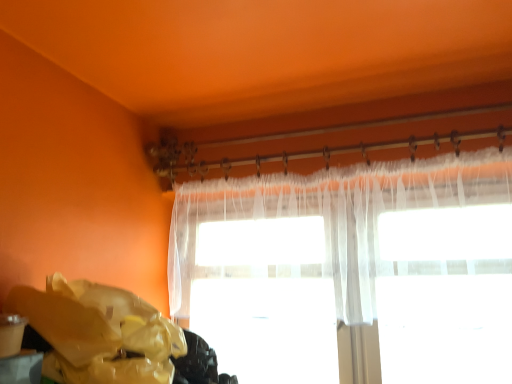
This screenshot has width=512, height=384. Describe the element at coordinates (345, 227) in the screenshot. I see `sheer white curtain at upper center` at that location.

The width and height of the screenshot is (512, 384). Identify the location of sheer white curtain at upper center. (345, 227).

In order to face yellow plastic bag at lower left, should I rotate leftwards or rightwards?

To align with it, rotate left about 15.816°.

The width and height of the screenshot is (512, 384). In order to click on yellow plastic bag at lower left in this screenshot , I will do `click(99, 332)`.

Image resolution: width=512 pixels, height=384 pixels. Describe the element at coordinates (99, 332) in the screenshot. I see `yellow plastic bag at lower left` at that location.

The width and height of the screenshot is (512, 384). In order to click on sheer white curtain at upper center in this screenshot , I will do `click(345, 227)`.

Is yellow plastic bag at lower left at the right side of sheer white curtain at upper center?

In fact, yellow plastic bag at lower left is to the left of sheer white curtain at upper center.

Is yellow plastic bag at lower left in front of or behind sheer white curtain at upper center in the image?

Clearly, yellow plastic bag at lower left is in front of sheer white curtain at upper center.

Does point (106, 318) come behind point (467, 208)?

That is False.

From the image's perspective, is yellow plastic bag at lower left on sheer white curtain at upper center?

Incorrect, from the image's perspective, yellow plastic bag at lower left is lower than sheer white curtain at upper center.

From a real-world perspective, is yellow plastic bag at lower left located higher than sheer white curtain at upper center?

No, from a real-world perspective, yellow plastic bag at lower left is not over sheer white curtain at upper center

Can you confirm if yellow plastic bag at lower left is wider than sheer white curtain at upper center?

Indeed, yellow plastic bag at lower left has a greater width compared to sheer white curtain at upper center.

Considering the sizes of objects yellow plastic bag at lower left and sheer white curtain at upper center in the image provided, who is taller, yellow plastic bag at lower left or sheer white curtain at upper center?

With more height is sheer white curtain at upper center.

Between yellow plastic bag at lower left and sheer white curtain at upper center, which one has larger size?

sheer white curtain at upper center is bigger.

Could sheer white curtain at upper center be considered to be inside yellow plastic bag at lower left?

No, sheer white curtain at upper center is not surrounded by yellow plastic bag at lower left.

Is yellow plastic bag at lower left next to sheer white curtain at upper center?

There is a gap between yellow plastic bag at lower left and sheer white curtain at upper center.

Is yellow plastic bag at lower left oriented away from sheer white curtain at upper center?

yellow plastic bag at lower left is not turned away from sheer white curtain at upper center.

How distant is yellow plastic bag at lower left from sheer white curtain at upper center?

yellow plastic bag at lower left and sheer white curtain at upper center are 76.24 centimeters apart.

Where is `waste below the sheer white curtain at upper center (from a real-world perspective)`? This screenshot has width=512, height=384. waste below the sheer white curtain at upper center (from a real-world perspective) is located at coordinates (99, 332).

Is sheer white curtain at upper center at the right side of yellow plastic bag at lower left?

Yes, sheer white curtain at upper center is to the right of yellow plastic bag at lower left.

Who is more distant, sheer white curtain at upper center or yellow plastic bag at lower left?

sheer white curtain at upper center is behind.

Is point (453, 252) behind point (96, 368)?

That is True.

From the image's perspective, is sheer white curtain at upper center located beneath yellow plastic bag at lower left?

No.

From a real-world perspective, is sheer white curtain at upper center physically below yellow plastic bag at lower left?

Actually, sheer white curtain at upper center is physically above yellow plastic bag at lower left in the real world.

Is sheer white curtain at upper center wider or thinner than yellow plastic bag at lower left?

Considering their sizes, sheer white curtain at upper center looks slimmer than yellow plastic bag at lower left.

Does sheer white curtain at upper center have a lesser height compared to yellow plastic bag at lower left?

In fact, sheer white curtain at upper center may be taller than yellow plastic bag at lower left.

Considering the relative sizes of sheer white curtain at upper center and yellow plastic bag at lower left in the image provided, is sheer white curtain at upper center bigger than yellow plastic bag at lower left?

Correct, sheer white curtain at upper center is larger in size than yellow plastic bag at lower left.

Which is correct: sheer white curtain at upper center is inside yellow plastic bag at lower left, or outside of it?

sheer white curtain at upper center is not enclosed by yellow plastic bag at lower left.

Would you consider sheer white curtain at upper center to be distant from yellow plastic bag at lower left?

They are positioned close to each other.

Is sheer white curtain at upper center oriented away from yellow plastic bag at lower left?

No, sheer white curtain at upper center is not facing the opposite direction of yellow plastic bag at lower left.

Can you tell me how much sheer white curtain at upper center and yellow plastic bag at lower left differ in facing direction?

The facing directions of sheer white curtain at upper center and yellow plastic bag at lower left are 89.2 degrees apart.

You are a GUI agent. You are given a task and a screenshot of the screen. Output one action in this format:
    pyautogui.click(x=<x>, y=<y>)
    Task: Click on the curtain above the yellow plastic bag at lower left (from the image's perspective)
    
    Given the screenshot: What is the action you would take?
    [345, 227]

This screenshot has height=384, width=512. I want to click on waste beneath the sheer white curtain at upper center (from a real-world perspective), so click(x=99, y=332).

Where is `curtain on the right of the yellow plastic bag at lower left`? This screenshot has height=384, width=512. curtain on the right of the yellow plastic bag at lower left is located at coordinates (345, 227).